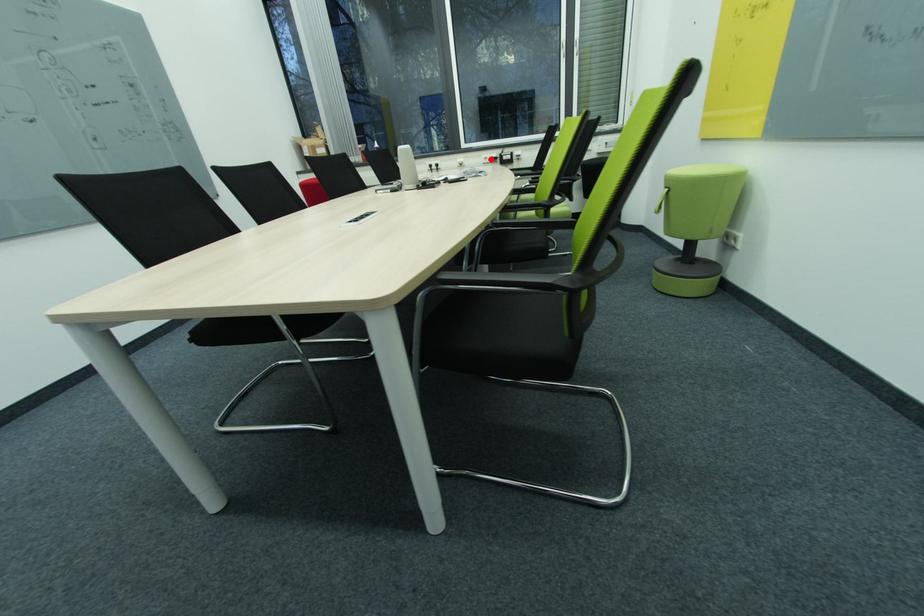
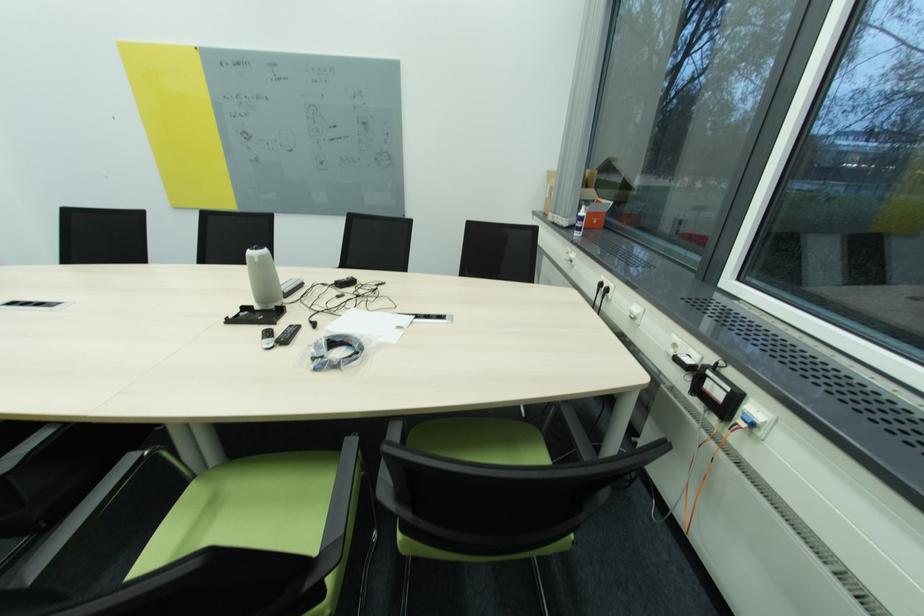
The point at the highlighted location is marked in the first image. Where is the corresponding point in the second image?

(679, 346)